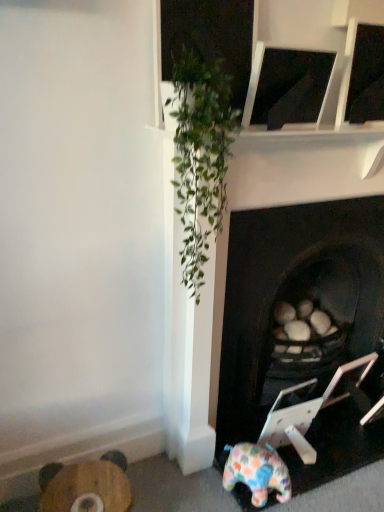
Question: From the image's perspective, is wooden stool at lower left located above dark wood fireplace at center?

Choices:
 (A) yes
 (B) no

Answer: (B)

Question: Is wooden stool at lower left next to dark wood fireplace at center?

Choices:
 (A) yes
 (B) no

Answer: (B)

Question: Is wooden stool at lower left positioned beyond the bounds of dark wood fireplace at center?

Choices:
 (A) no
 (B) yes

Answer: (B)

Question: Is wooden stool at lower left smaller than dark wood fireplace at center?

Choices:
 (A) no
 (B) yes

Answer: (B)

Question: Is dark wood fireplace at center completely or partially inside wooden stool at lower left?

Choices:
 (A) no
 (B) yes

Answer: (A)

Question: Is wooden stool at lower left to the left or to the right of dark wood fireplace at center in the image?

Choices:
 (A) left
 (B) right

Answer: (A)

Question: Considering the positions of wooden stool at lower left and dark wood fireplace at center in the image, is wooden stool at lower left taller or shorter than dark wood fireplace at center?

Choices:
 (A) short
 (B) tall

Answer: (A)

Question: From a real-world perspective, is wooden stool at lower left physically located above or below dark wood fireplace at center?

Choices:
 (A) below
 (B) above

Answer: (A)

Question: Is wooden stool at lower left spatially inside dark wood fireplace at center, or outside of it?

Choices:
 (A) outside
 (B) inside

Answer: (A)

Question: Is wooden stool at lower left inside the boundaries of multicolored plush elephant at lower right, or outside?

Choices:
 (A) outside
 (B) inside

Answer: (A)

Question: Is wooden stool at lower left in front of or behind multicolored plush elephant at lower right in the image?

Choices:
 (A) behind
 (B) front

Answer: (B)

Question: Looking at their shapes, would you say wooden stool at lower left is wider or thinner than multicolored plush elephant at lower right?

Choices:
 (A) wide
 (B) thin

Answer: (B)

Question: From the image's perspective, relative to multicolored plush elephant at lower right, is wooden stool at lower left above or below?

Choices:
 (A) above
 (B) below

Answer: (B)

Question: From the image's perspective, is multicolored plush elephant at lower right above or below wooden stool at lower left?

Choices:
 (A) above
 (B) below

Answer: (A)

Question: From a real-world perspective, relative to wooden stool at lower left, is multicolored plush elephant at lower right vertically above or below?

Choices:
 (A) below
 (B) above

Answer: (B)